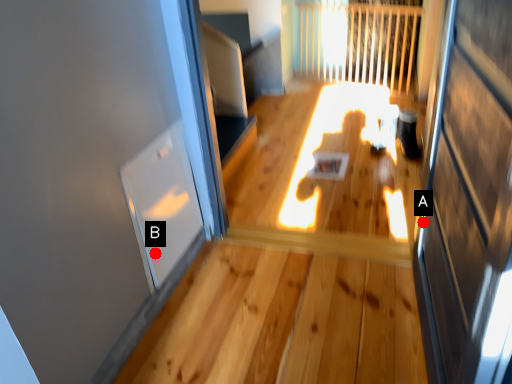
Question: Two points are circled on the image, labeled by A and B beside each circle. Which of the following is the farthest from the observer?

Choices:
 (A) A is further
 (B) B is further

Answer: (A)